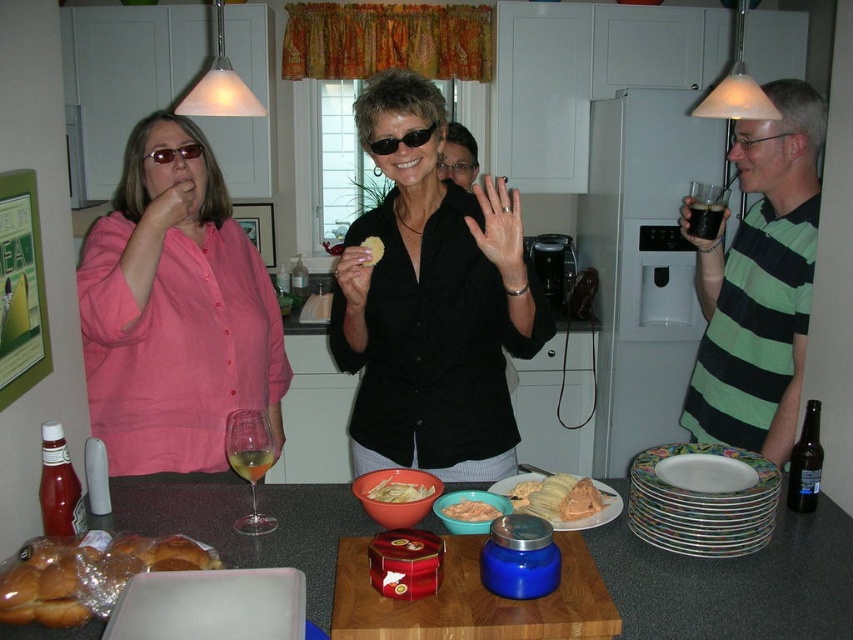
Is black matte shirt at center closer to camera compared to smooth orange dip at center?

No, it is behind smooth orange dip at center.

Is point (418, 77) more distant than point (451, 506)?

That is True.

Between point (479, 337) and point (456, 515), which one is positioned in front?

Point (456, 515)

This screenshot has height=640, width=853. Find the location of `black matte shirt at center`. black matte shirt at center is located at coordinates (431, 304).

Is the position of porcelain plate at center less distant than that of yellow crumbly at center?

That is True.

Looking at this image, who is lower down, porcelain plate at center or yellow crumbly at center?

porcelain plate at center

The width and height of the screenshot is (853, 640). I want to click on porcelain plate at center, so click(x=705, y=474).

Can you confirm if yellow crispy chips at center is smaller than translucent glass wine at center?

Yes.

Based on the photo, is yellow crispy chips at center thinner than translucent glass wine at center?

Correct, yellow crispy chips at center's width is less than translucent glass wine at center's.

Is point (424, 490) in front of point (234, 452)?

No, (424, 490) is further to viewer.

This screenshot has width=853, height=640. Identify the location of yellow crispy chips at center. (401, 490).